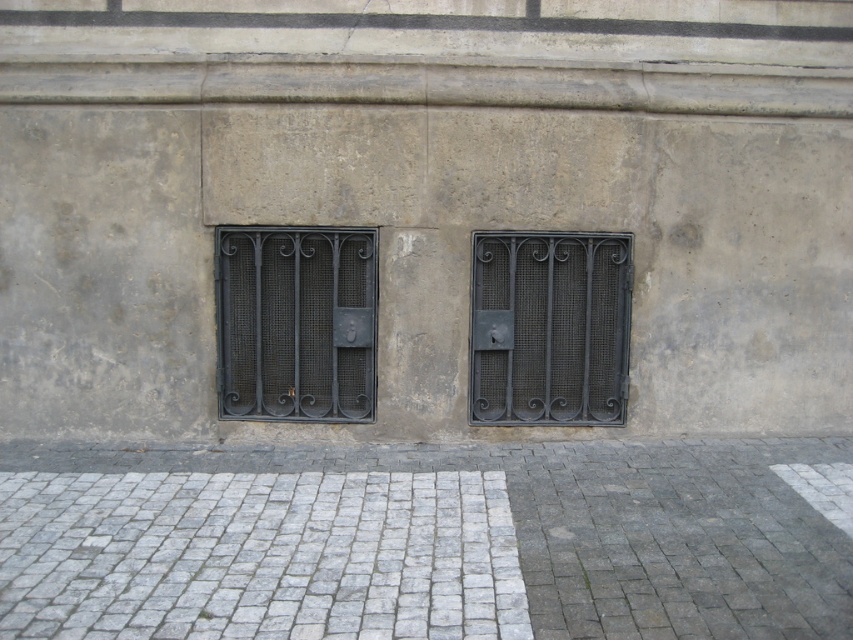
Question: Can you confirm if black wrought iron grill at center is positioned to the left of black wrought iron window at center?

Choices:
 (A) no
 (B) yes

Answer: (A)

Question: Does gray cobblestone pavement at center have a larger size compared to black wrought iron grill at center?

Choices:
 (A) yes
 (B) no

Answer: (A)

Question: Which object is the farthest from the gray cobblestone pavement at center?

Choices:
 (A) black wrought iron window at center
 (B) black wrought iron grill at center

Answer: (A)

Question: Which object appears closest to the camera in this image?

Choices:
 (A) black wrought iron grill at center
 (B) gray cobblestone pavement at center
 (C) black wrought iron window at center

Answer: (B)

Question: Considering the relative positions of gray cobblestone pavement at center and black wrought iron window at center in the image provided, where is gray cobblestone pavement at center located with respect to black wrought iron window at center?

Choices:
 (A) left
 (B) right

Answer: (B)

Question: Among these points, which one is nearest to the camera?

Choices:
 (A) (61, 573)
 (B) (247, 365)
 (C) (556, 243)

Answer: (A)